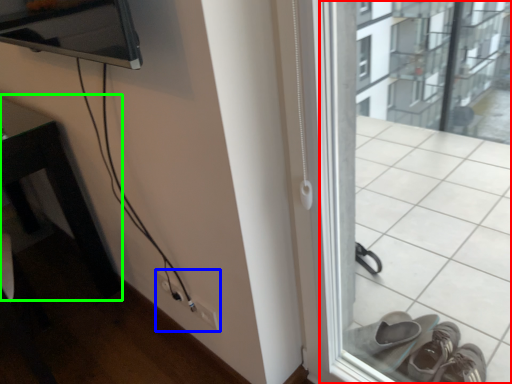
Question: Considering the real-world distances, which object is closest to window frame (highlighted by a red box)? electric outlet (highlighted by a blue box) or table (highlighted by a green box).

Choices:
 (A) electric outlet
 (B) table

Answer: (A)